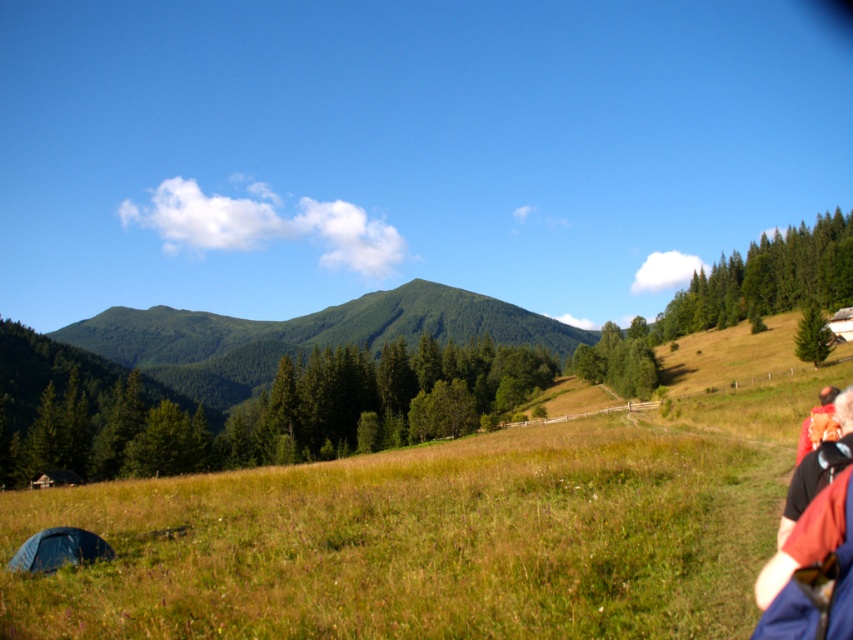
You are a photographer standing at the center of the field in the mountain landscape. You want to take a photo that includes both the point at coordinates point (811, 474) and the point at coordinates point (68, 529). Which point will appear closer to the bottom edge of your camera frame?

The point at coordinates point (811, 474) will appear closer to the bottom edge of your camera frame because it is closer to the camera than point (68, 529).

You are a hiker who has just arrived at the campsite. You notice the red fabric jacket at lower right and the dark blue fabric tent at lower left. Which item takes up more horizontal space in the image?

The dark blue fabric tent at lower left has a greater width than the red fabric jacket at lower right, so the tent takes up more horizontal space.